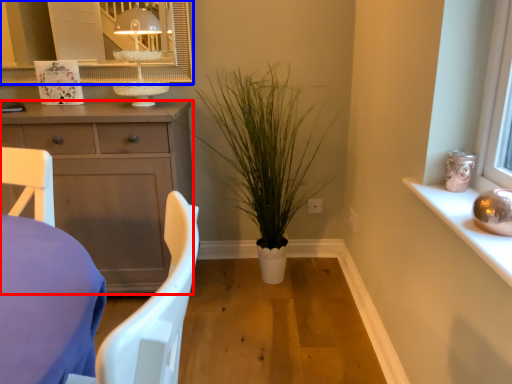
Question: Among these objects, which one is farthest to the camera, cabinetry (highlighted by a red box) or mirror (highlighted by a blue box)?

Choices:
 (A) cabinetry
 (B) mirror

Answer: (B)